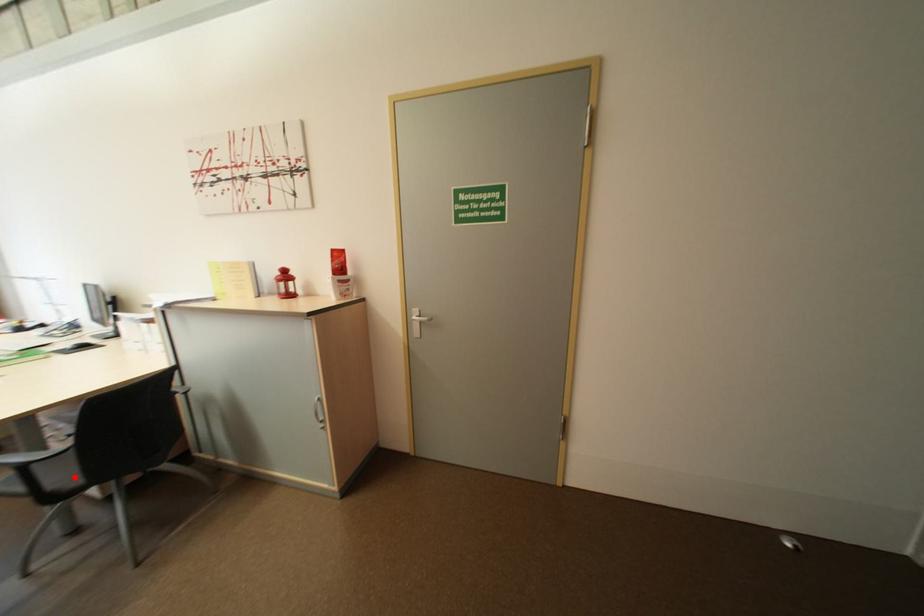
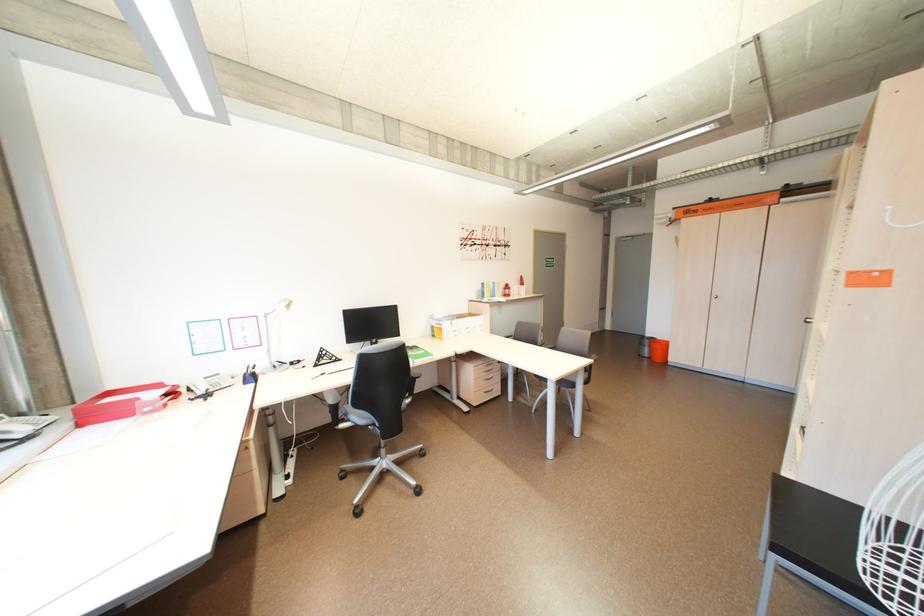
Question: I am providing you with two images of the same scene from different viewpoints. A red point is marked on the first image. At the location where the point appears in image 1, is it still visible in image 2?

Choices:
 (A) Yes
 (B) No

Answer: (B)